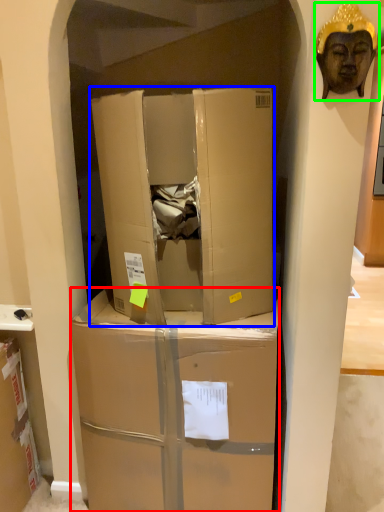
Question: Based on their relative distances, which object is nearer to box (highlighted by a red box)? Choose from box (highlighted by a blue box) and person (highlighted by a green box).

Choices:
 (A) box
 (B) person

Answer: (A)